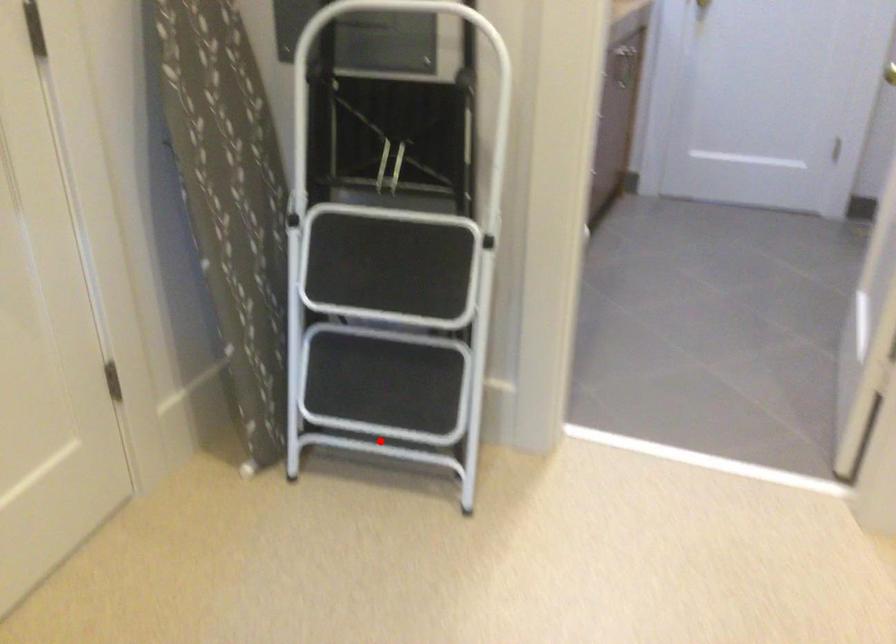
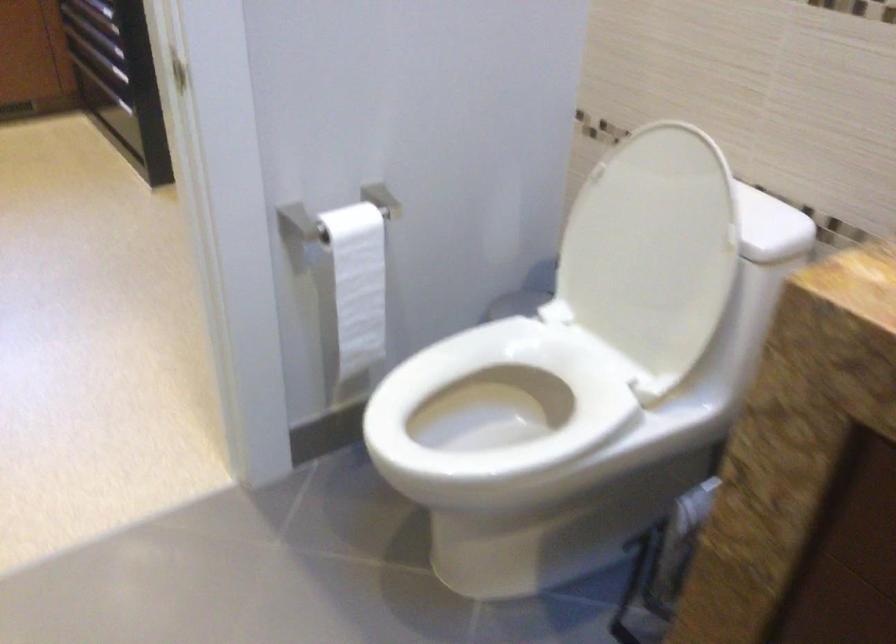
Question: I am providing you with two images of the same scene from different viewpoints. A red point is marked on the first image. Can you still see the location of the red point in image 2?

Choices:
 (A) Yes
 (B) No

Answer: (B)